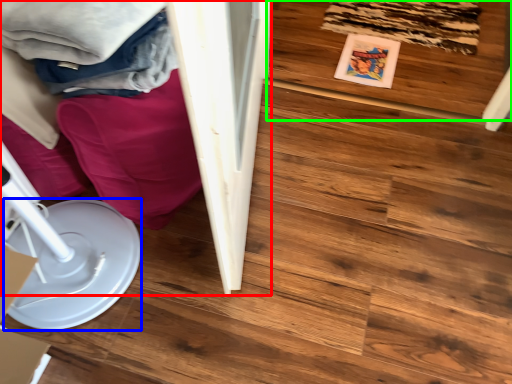
Question: Which is nearer to the furniture (highlighted by a red box)? paper plate (highlighted by a blue box) or wood (highlighted by a green box).

Choices:
 (A) paper plate
 (B) wood

Answer: (A)